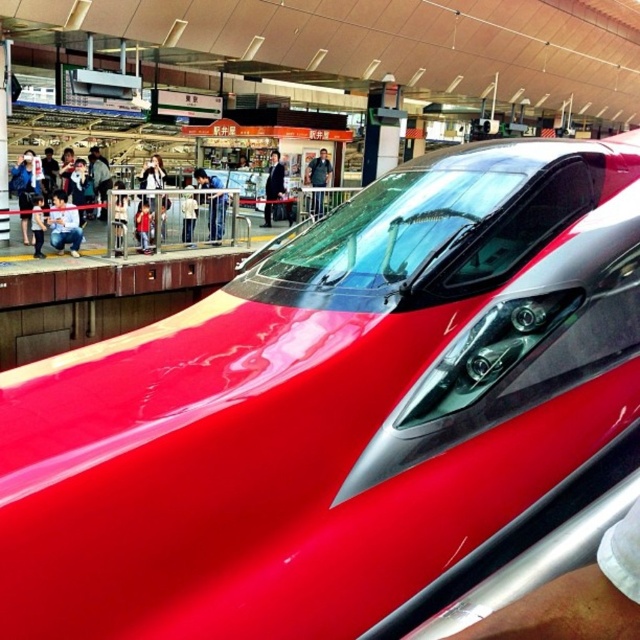
Between dark blue shirt at center and white fabric jacket at center, which one appears on the right side from the viewer's perspective?

From the viewer's perspective, dark blue shirt at center appears more on the right side.

Who is more distant from viewer, [330,179] or [192,184]?

Point [330,179]

Find the location of `dark blue shirt at center`. dark blue shirt at center is located at coordinates (317, 170).

Does jeans at left appear on the right side of smooth skin person at center?

In fact, jeans at left is to the left of smooth skin person at center.

What are the coordinates of `jeans at left` in the screenshot? It's located at (64, 225).

Does point (56, 236) come closer to viewer compared to point (209, 186)?

Yes.

At what (x,y) coordinates should I click in order to perform the action: click on jeans at left. Please return your answer as a coordinate pair (x, y). This screenshot has width=640, height=640. Looking at the image, I should click on (64, 225).

Who is positioned more to the left, dark blue shirt at center or black suit at center?

black suit at center is more to the left.

Does point (316, 209) come behind point (262, 216)?

No, (316, 209) is closer to viewer.

Is point (324, 184) positioned behind point (282, 173)?

Yes, it is.

At what (x,y) coordinates should I click in order to perform the action: click on dark blue shirt at center. Please return your answer as a coordinate pair (x, y). The image size is (640, 640). Looking at the image, I should click on (317, 170).